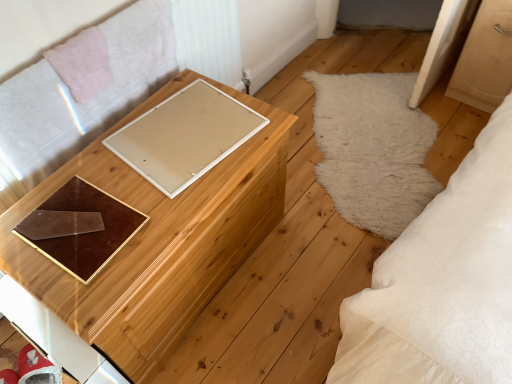
Identify the location of free spot below brown glossy tray at center (from a real-world perspective). (78, 220).